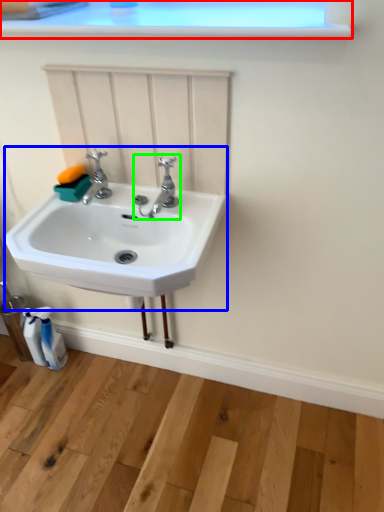
Question: Which object is the closest to the window frame (highlighted by a red box)? Choose among these: sink (highlighted by a blue box) or tap (highlighted by a green box).

Choices:
 (A) sink
 (B) tap

Answer: (B)